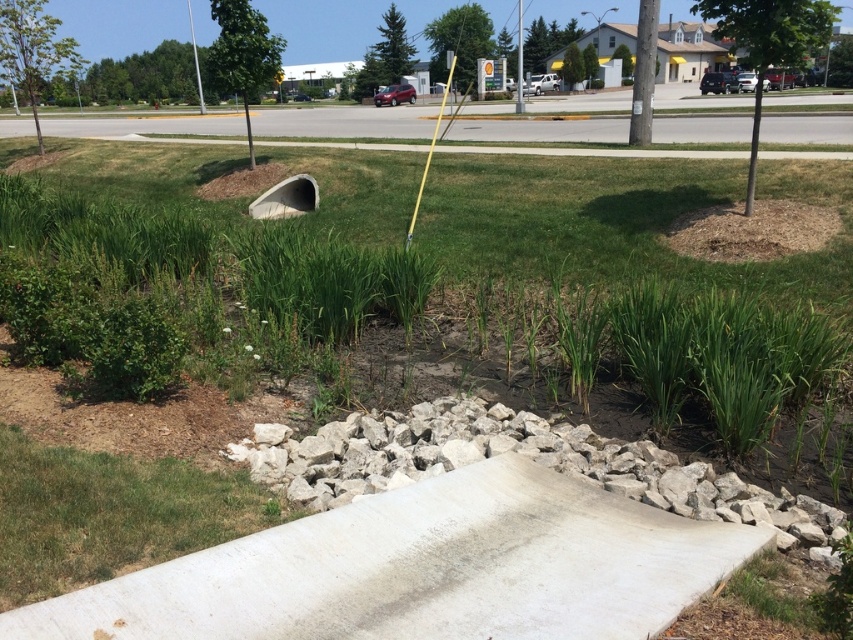
You are a gardener who needs to mow the green grass at lower left and inspect the concrete tunnel at center. Which task should you attend to first if you want to tackle the shorter item first?

The green grass at lower left is not as tall as the concrete tunnel at center, so you should mow the green grass at lower left first since it is shorter.

You are a gardener trying to plant flowers in the green grass at lower left. You need to know if the concrete tunnel at center is above or below the grass. Which direction should you look to see the tunnel from the grass?

The green grass at lower left is below the concrete tunnel at center, so you should look upward to see the tunnel from the grass.

You are a delivery person trying to navigate a narrow cart through the landscaped area. You need to move from the road to the grassy patch. Which direction should you steer your cart to go from the white concrete ramp at lower center to the green grass at lower left?

The white concrete ramp at lower center is positioned on the right side of green grass at lower left. To reach the green grass at lower left from the white concrete ramp at lower center, you should steer your cart to the left.